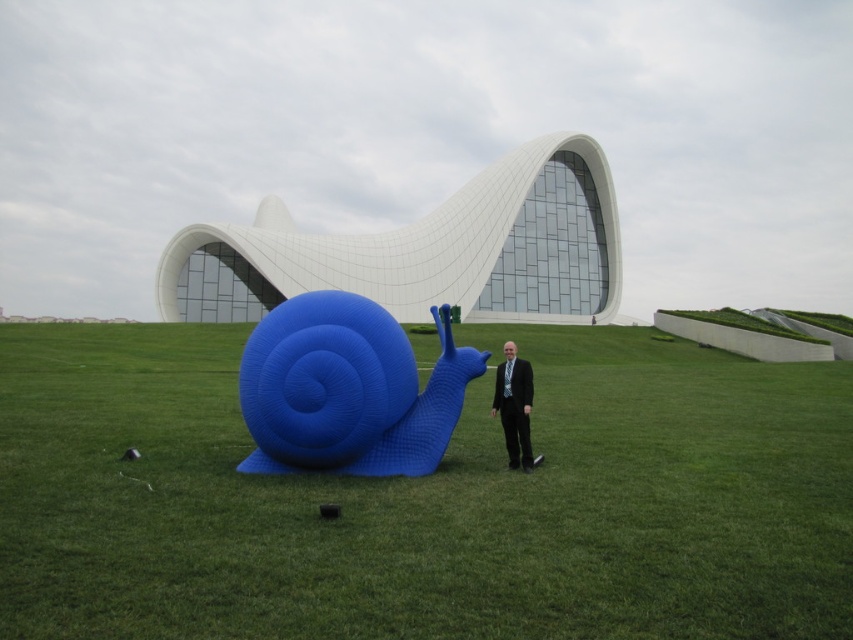
Question: Which of the following is the closest to the observer?

Choices:
 (A) blue matte snail at center
 (B) white smooth building at center

Answer: (A)

Question: Is white smooth building at center to the right of blue matte snail at center from the viewer's perspective?

Choices:
 (A) yes
 (B) no

Answer: (B)

Question: Is green grassy at center to the left of white smooth building at center from the viewer's perspective?

Choices:
 (A) no
 (B) yes

Answer: (A)

Question: Which of the following is the closest to the observer?

Choices:
 (A) (526, 168)
 (B) (363, 387)

Answer: (B)

Question: Can you confirm if green grassy at center is thinner than white smooth building at center?

Choices:
 (A) yes
 (B) no

Answer: (A)

Question: Which point appears closest to the camera in this image?

Choices:
 (A) click(x=187, y=241)
 (B) click(x=260, y=403)
 (C) click(x=524, y=470)
 (D) click(x=674, y=444)

Answer: (B)